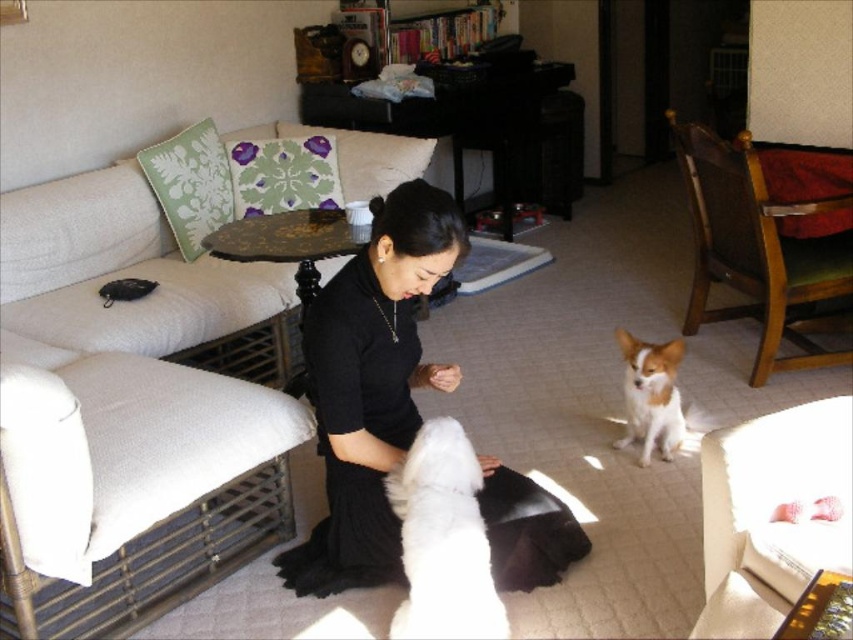
You are a guest entering the living room and want to sit on the closest couch. There are two couches in the room, the white fabric couch at left and the white fabric couch at lower right. Which couch should you choose to sit on?

The white fabric couch at lower right is closer to the entrance, so you should choose the white fabric couch at lower right to sit on.

You are standing at the point labeled point (763, 598) in the living room. You want to move to the point labeled point (138, 452). Is the path between these two points clear of any obstacles?

Answer: The path between point (763, 598) and point (138, 452) is clear since there are no objects mentioned in the scene that would block the path between these two points.